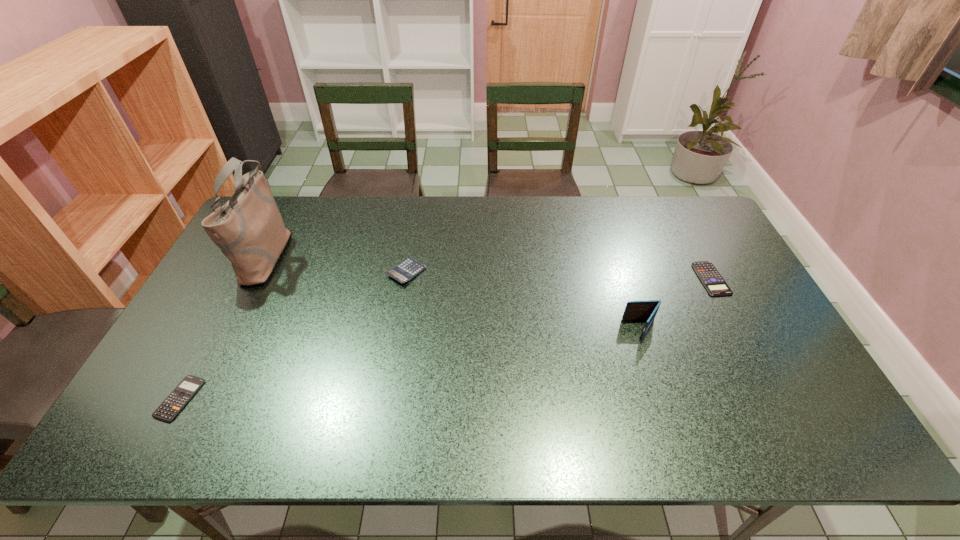
Where is `vacant space located 0.060m on the exterior surface of the wallet`? The image size is (960, 540). vacant space located 0.060m on the exterior surface of the wallet is located at coordinates (603, 329).

This screenshot has height=540, width=960. What are the coordinates of `free space located on the exterior surface of the wallet` in the screenshot? It's located at (533, 329).

Identify the location of vacant space situated 0.110m on the exterior surface of the wallet. (585, 329).

Locate an element on the screen. Image resolution: width=960 pixels, height=540 pixels. vacant point located 0.090m on the right of the third object from left to right is located at coordinates (455, 272).

This screenshot has width=960, height=540. What are the coordinates of `free spot located on the left of the second shortest object` in the screenshot? It's located at (589, 279).

Locate an element on the screen. free location located 0.160m on the right of the shortest calculator is located at coordinates (264, 399).

Find the location of a particular element. object situated at the far edge is located at coordinates (249, 230).

What are the coordinates of `object that is at the near edge` in the screenshot? It's located at (186, 389).

Where is `shoulder bag present at the left edge`? This screenshot has width=960, height=540. shoulder bag present at the left edge is located at coordinates (249, 230).

The width and height of the screenshot is (960, 540). What are the coordinates of `calculator that is at the left edge` in the screenshot? It's located at (186, 389).